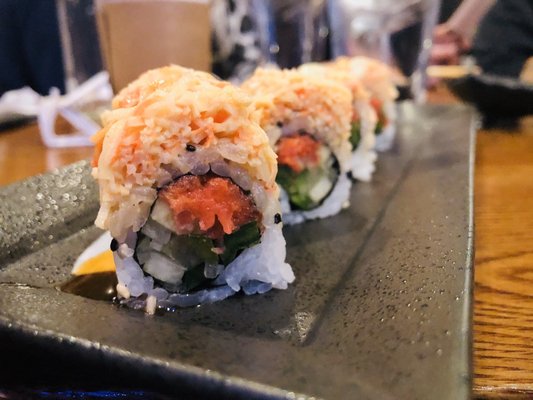
Locate an element on the screen. This screenshot has width=533, height=400. wooden table edge is located at coordinates (x=506, y=389).